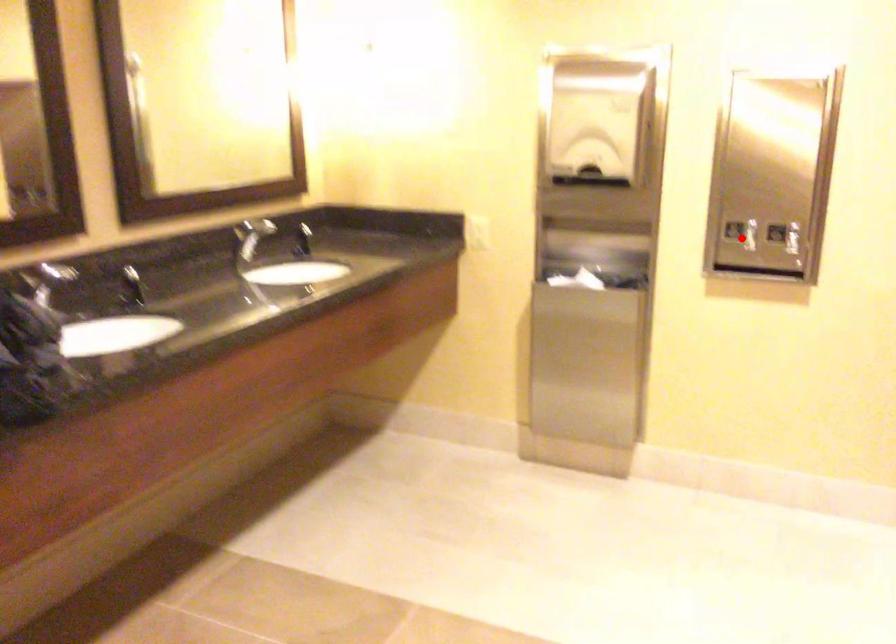
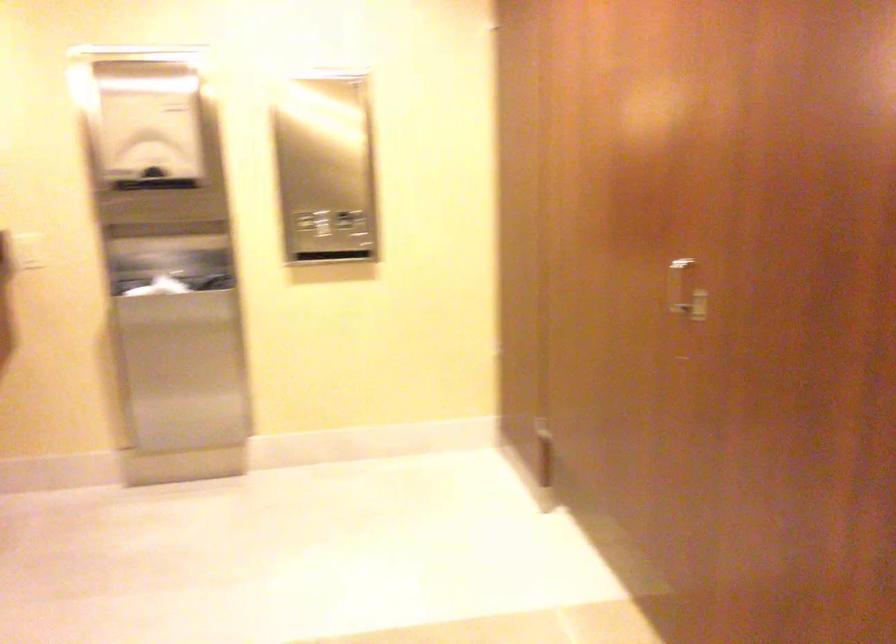
In the second image, find the point that corresponds to the highlighted location in the first image.

(317, 229)